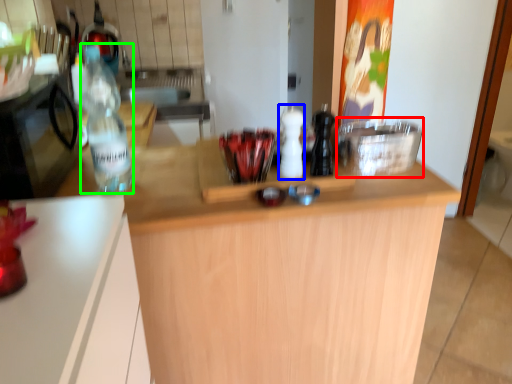
Question: Which is farther away from appliance (highlighted by a red box)? bottle (highlighted by a blue box) or bottle (highlighted by a green box)?

Choices:
 (A) bottle
 (B) bottle

Answer: (B)